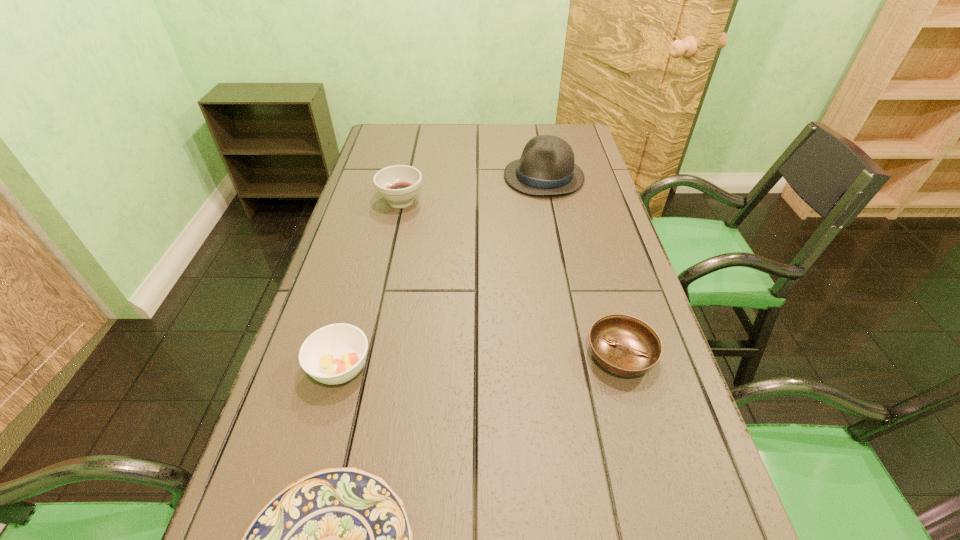
You are a GUI agent. You are given a task and a screenshot of the screen. Output one action in this format:
    pyautogui.click(x=<x>, y=<y>)
    Task: Click on the bowler hat
    
    Given the screenshot: What is the action you would take?
    [547, 166]

The image size is (960, 540). Identify the location of the fourth shortest object. (399, 184).

Locate an element on the screen. The width and height of the screenshot is (960, 540). the tallest soup bowl is located at coordinates (399, 184).

The height and width of the screenshot is (540, 960). Identify the location of the third shortest object. (334, 354).

In order to click on the fourth tallest object in this screenshot , I will do `click(624, 345)`.

Find the location of a particular element. The height and width of the screenshot is (540, 960). the rightmost soup bowl is located at coordinates coord(624,345).

Locate an element on the screen. The width and height of the screenshot is (960, 540). vacant region located 0.330m on the front-facing side of the tallest object is located at coordinates (403, 177).

Find the location of a particular element. vacant space located on the front-facing side of the tallest object is located at coordinates (446, 177).

Identify the location of vacant region located on the front-facing side of the tallest object. (395, 177).

Where is `free location located on the front of the fourth shortest object`? Image resolution: width=960 pixels, height=540 pixels. free location located on the front of the fourth shortest object is located at coordinates (390, 253).